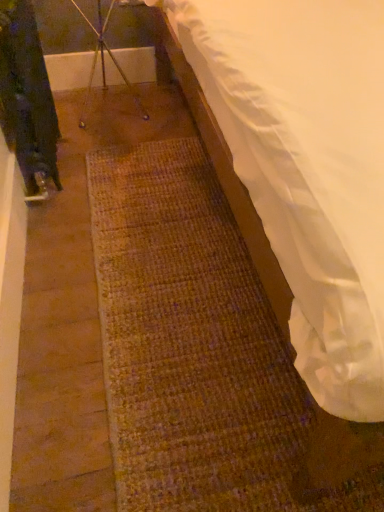
The height and width of the screenshot is (512, 384). What do you see at coordinates (308, 168) in the screenshot? I see `white fabric mattress at lower right` at bounding box center [308, 168].

I want to click on white fabric mattress at lower right, so click(308, 168).

In the scene shown: What is the approximate height of metallic tripod at upper center?

metallic tripod at upper center is 19.71 inches tall.

The width and height of the screenshot is (384, 512). Describe the element at coordinates (104, 59) in the screenshot. I see `metallic tripod at upper center` at that location.

Identify the location of metallic tripod at upper center. The height and width of the screenshot is (512, 384). (104, 59).

The width and height of the screenshot is (384, 512). I want to click on white fabric mattress at lower right, so click(x=308, y=168).

Between metallic tripod at upper center and white fabric mattress at lower right, which one appears on the left side from the viewer's perspective?

From the viewer's perspective, metallic tripod at upper center appears more on the left side.

In the image, is metallic tripod at upper center positioned in front of or behind white fabric mattress at lower right?

metallic tripod at upper center is behind white fabric mattress at lower right.

Considering the points (104, 88) and (377, 71), which point is behind, point (104, 88) or point (377, 71)?

Point (104, 88)

From the image's perspective, which is above, metallic tripod at upper center or white fabric mattress at lower right?

metallic tripod at upper center is shown above in the image.

From a real-world perspective, which is physically above, metallic tripod at upper center or white fabric mattress at lower right?

white fabric mattress at lower right is physically above.

Considering the relative sizes of metallic tripod at upper center and white fabric mattress at lower right in the image provided, is metallic tripod at upper center thinner than white fabric mattress at lower right?

Correct, the width of metallic tripod at upper center is less than that of white fabric mattress at lower right.

Can you confirm if metallic tripod at upper center is shorter than white fabric mattress at lower right?

Yes.

Considering the relative sizes of metallic tripod at upper center and white fabric mattress at lower right in the image provided, is metallic tripod at upper center smaller than white fabric mattress at lower right?

Indeed, metallic tripod at upper center has a smaller size compared to white fabric mattress at lower right.

Would you say metallic tripod at upper center contains white fabric mattress at lower right?

No, white fabric mattress at lower right is not surrounded by metallic tripod at upper center.

Is there a large distance between metallic tripod at upper center and white fabric mattress at lower right?

Yes.

Consider the image. Is metallic tripod at upper center looking in the opposite direction of white fabric mattress at lower right?

No, white fabric mattress at lower right is not at the back of metallic tripod at upper center.

How many degrees apart are the facing directions of metallic tripod at upper center and white fabric mattress at lower right?

The facing directions of metallic tripod at upper center and white fabric mattress at lower right are 1.33 degrees apart.

How distant is metallic tripod at upper center from white fabric mattress at lower right?

metallic tripod at upper center and white fabric mattress at lower right are 3.96 feet apart from each other.

Image resolution: width=384 pixels, height=512 pixels. I want to click on tripod lying behind the white fabric mattress at lower right, so click(x=104, y=59).

Considering the positions of objects white fabric mattress at lower right and metallic tripod at upper center in the image provided, who is more to the left, white fabric mattress at lower right or metallic tripod at upper center?

Positioned to the left is metallic tripod at upper center.

Considering the positions of objects white fabric mattress at lower right and metallic tripod at upper center in the image provided, who is behind, white fabric mattress at lower right or metallic tripod at upper center?

metallic tripod at upper center is further away from the camera.

Which is more distant, (379, 302) or (103, 58)?

Point (103, 58)

From the image's perspective, is white fabric mattress at lower right beneath metallic tripod at upper center?

Correct, white fabric mattress at lower right appears lower than metallic tripod at upper center in the image.

From a real-world perspective, relative to metallic tripod at upper center, is white fabric mattress at lower right vertically above or below?

In terms of real-world spatial position, white fabric mattress at lower right is above metallic tripod at upper center.

Can you confirm if white fabric mattress at lower right is thinner than metallic tripod at upper center?

No, white fabric mattress at lower right is not thinner than metallic tripod at upper center.

Which of these two, white fabric mattress at lower right or metallic tripod at upper center, stands shorter?

metallic tripod at upper center is shorter.

Who is bigger, white fabric mattress at lower right or metallic tripod at upper center?

white fabric mattress at lower right is bigger.

Is metallic tripod at upper center located within white fabric mattress at lower right?

No, metallic tripod at upper center is not a part of white fabric mattress at lower right.

Is white fabric mattress at lower right next to metallic tripod at upper center and touching it?

They are not placed beside each other.

Could you tell me if white fabric mattress at lower right is turned towards metallic tripod at upper center?

No, white fabric mattress at lower right is not aimed at metallic tripod at upper center.

The image size is (384, 512). I want to click on mattress that is in front of the metallic tripod at upper center, so click(x=308, y=168).

At what (x,y) coordinates should I click in order to perform the action: click on mattress lying on the right of metallic tripod at upper center. Please return your answer as a coordinate pair (x, y). Looking at the image, I should click on (308, 168).

Where is `tripod below the white fabric mattress at lower right (from a real-world perspective)`? tripod below the white fabric mattress at lower right (from a real-world perspective) is located at coordinates (104, 59).